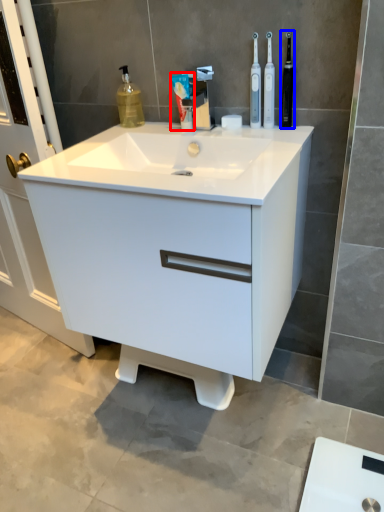
Question: Which object is further to the camera taking this photo, toothpaste (highlighted by a red box) or toiletry (highlighted by a blue box)?

Choices:
 (A) toothpaste
 (B) toiletry

Answer: (A)